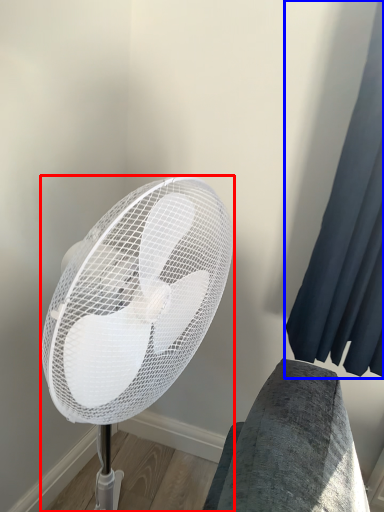
Question: Among these objects, which one is nearest to the camera, mechanical fan (highlighted by a red box) or curtain (highlighted by a blue box)?

Choices:
 (A) mechanical fan
 (B) curtain

Answer: (A)